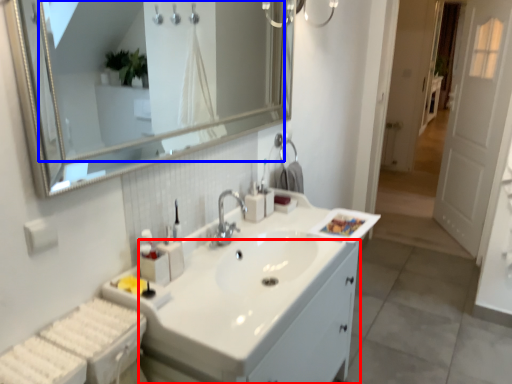
Question: Which of the following is the closest to the observer, bathroom cabinet (highlighted by a red box) or mirror (highlighted by a blue box)?

Choices:
 (A) bathroom cabinet
 (B) mirror

Answer: (B)